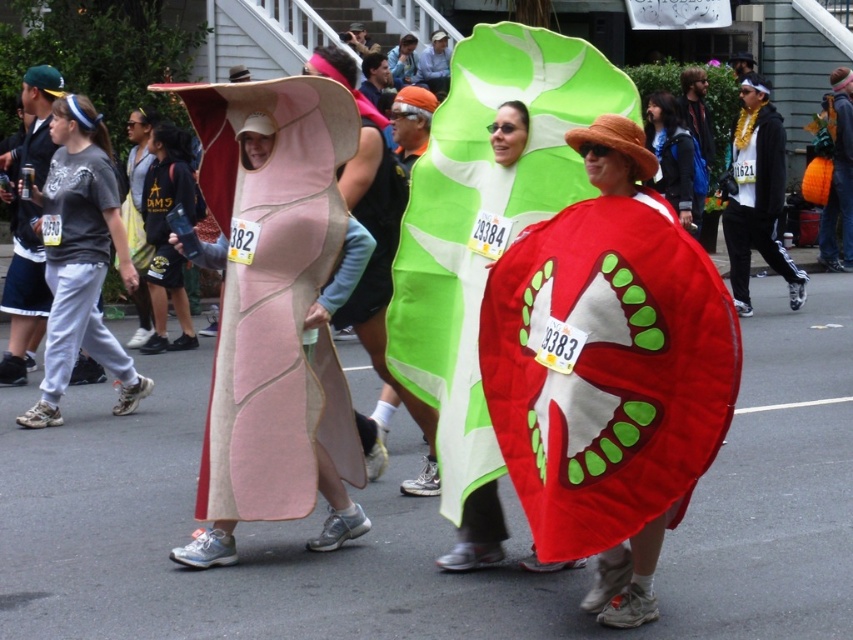
Is velvet red heart at center below matte black jacket at center?

Indeed, velvet red heart at center is positioned under matte black jacket at center.

Who is shorter, velvet red heart at center or matte black jacket at center?

Standing shorter between the two is velvet red heart at center.

Image resolution: width=853 pixels, height=640 pixels. Describe the element at coordinates (606, 371) in the screenshot. I see `velvet red heart at center` at that location.

Where is `velvet red heart at center`? velvet red heart at center is located at coordinates (606, 371).

Where is `gray cotton t-shirt at left`? The image size is (853, 640). gray cotton t-shirt at left is located at coordinates (78, 266).

Which of these two, gray cotton t-shirt at left or matte green fabric at center, stands taller?

With more height is gray cotton t-shirt at left.

Where is `gray cotton t-shirt at left`? This screenshot has width=853, height=640. gray cotton t-shirt at left is located at coordinates (78, 266).

Between velvet red heart at center and matte green fabric at center, which one has less height?

matte green fabric at center

Does velvet red heart at center appear on the left side of matte green fabric at center?

Incorrect, velvet red heart at center is not on the left side of matte green fabric at center.

At what (x,y) coordinates should I click in order to perform the action: click on velvet red heart at center. Please return your answer as a coordinate pair (x, y). Image resolution: width=853 pixels, height=640 pixels. Looking at the image, I should click on (606, 371).